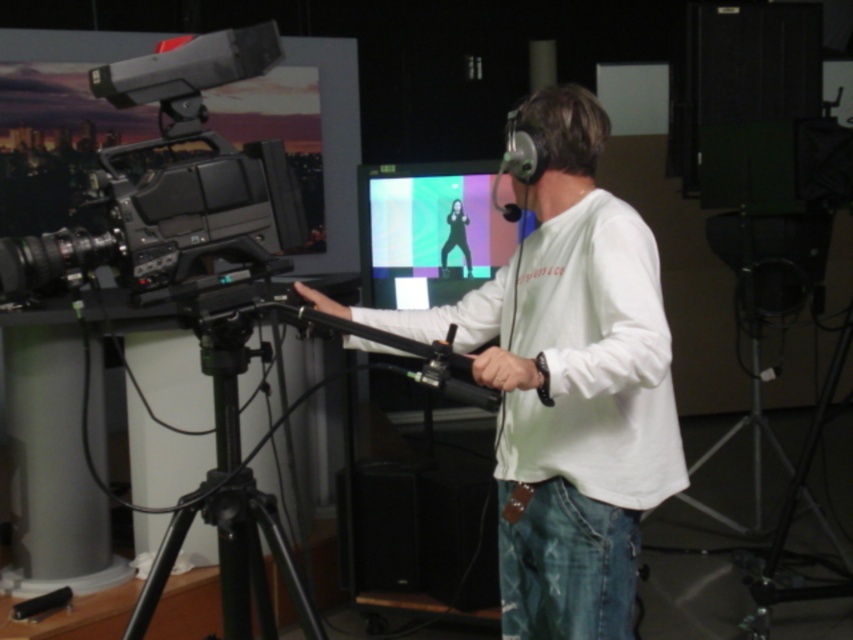
You are standing in the studio and see two points marked on the floor. The first point is at coordinates point [210,177] and the second point is at point [368,170]. Which point is closer to you?

Point [210,177] is closer to the viewer than point [368,170].

You are a technician in a TV studio. You need to place a 24 inch cable between the white matte shirt at center and the matte black camera at left. Will the cable be long enough?

The distance between the white matte shirt at center and the matte black camera at left is 22.13 inches. The 24 inch cable is longer than the required distance, so it will be sufficient.